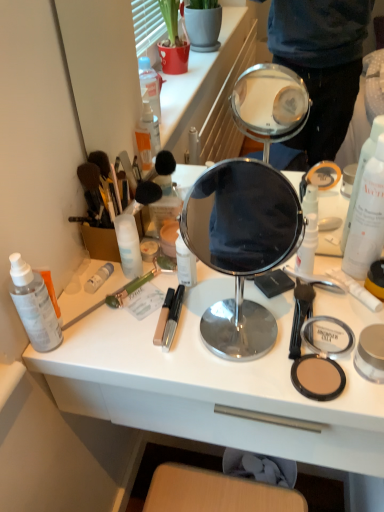
Question: Looking at the image, does translucent plastic spray bottle at left, which is the 2th toiletry in left-to-right order, seem bigger or smaller compared to polished silver mirror at center?

Choices:
 (A) big
 (B) small

Answer: (B)

Question: Which is correct: translucent plastic spray bottle at left, which is the 2th toiletry in left-to-right order, is inside polished silver mirror at center, or outside of it?

Choices:
 (A) outside
 (B) inside

Answer: (A)

Question: Based on their relative distances, which object is nearer to the transparent plastic spray bottle at left, the 1th toiletry when ordered from left to right?

Choices:
 (A) white plastic drawer at lower center
 (B) white matte tube at left, the 4th toiletry when ordered from right to left
 (C) translucent plastic spray bottle at left, which is the 2th toiletry in left-to-right order
 (D) white matte spray bottle at right
 (E) matte yellow compact powder at right, the first toiletry when ordered from right to left

Answer: (C)

Question: Considering the real-world distances, which object is farthest from the matte black compact at lower right?

Choices:
 (A) white matte bottle at center-left, the 3th toiletry viewed from the right
 (B) white plastic desk at center
 (C) white plastic drawer at lower center
 (D) transparent plastic spray bottle at left, which is the 6th toiletry in right-to-left order
 (E) polished silver mirror at center

Answer: (E)